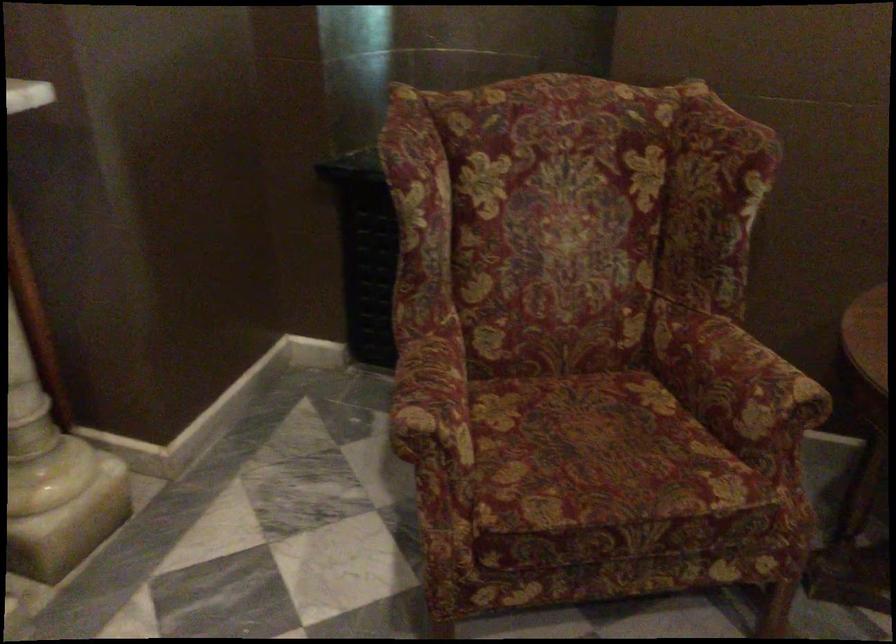
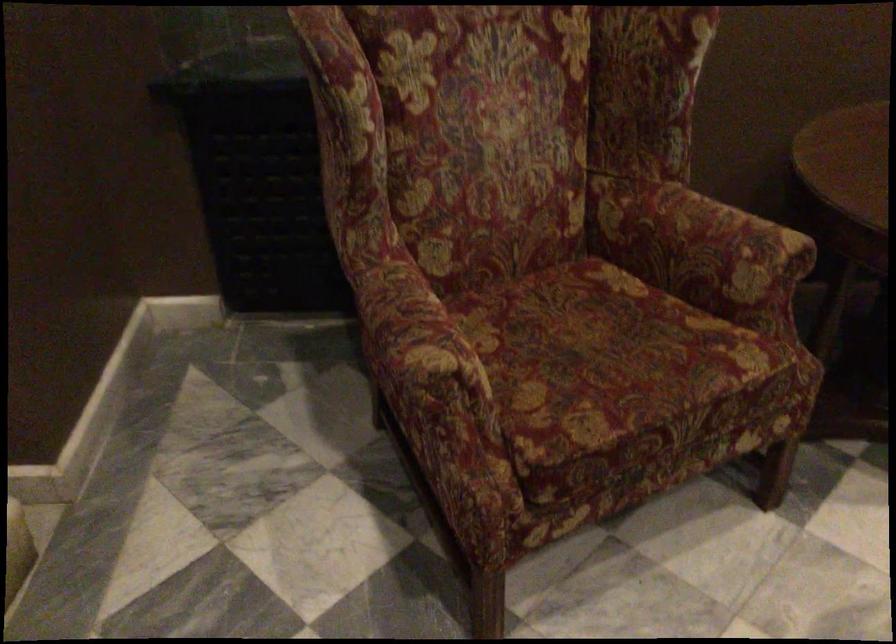
The point at (409, 431) is marked in the first image. Where is the corresponding point in the second image?

(428, 377)